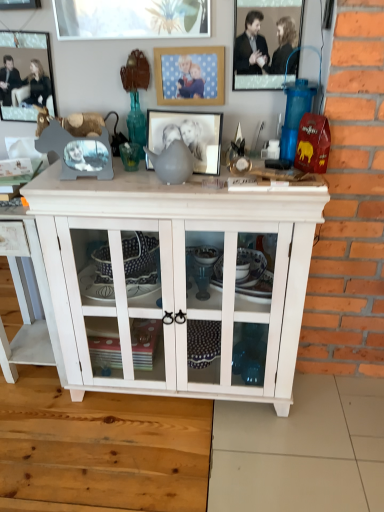
Question: From a real-world perspective, is matte gray picture frame at center, marked as the 3th picture frame in a right-to-left arrangement, positioned above or below metallic silver picture frame at upper left, placed as the first picture frame when sorted from left to right?

Choices:
 (A) below
 (B) above

Answer: (A)

Question: From the image's perspective, is matte gray picture frame at center, marked as the 3th picture frame in a left-to-right arrangement, located above or below metallic silver picture frame at upper left, placed as the first picture frame when sorted from left to right?

Choices:
 (A) above
 (B) below

Answer: (B)

Question: Based on their relative distances, which object is farther from the metallic silver picture frame at upper left, placed as the first picture frame when sorted from left to right?

Choices:
 (A) white wood cabinet at center, the 2th table from the right
 (B) white wood cabinet at center, marked as the first table in a right-to-left arrangement
 (C) matte gray picture frame at center, marked as the 3th picture frame in a left-to-right arrangement
 (D) metallic silver picture frame at upper center, the 5th picture frame viewed from the left
 (E) brushed metal picture frame at upper left, arranged as the fourth picture frame when viewed from the right

Answer: (D)

Question: Which of these objects is positioned closest to the white wood cabinet at center, marked as the first table in a right-to-left arrangement?

Choices:
 (A) matte gray picture frame at center, marked as the 3th picture frame in a right-to-left arrangement
 (B) metallic silver picture frame at upper center, which ranks as the 1th picture frame in right-to-left order
 (C) metallic silver picture frame at upper left, placed as the first picture frame when sorted from left to right
 (D) white wood cabinet at center, the 2th table from the right
 (E) brushed metal picture frame at upper left, the second picture frame from the left

Answer: (A)